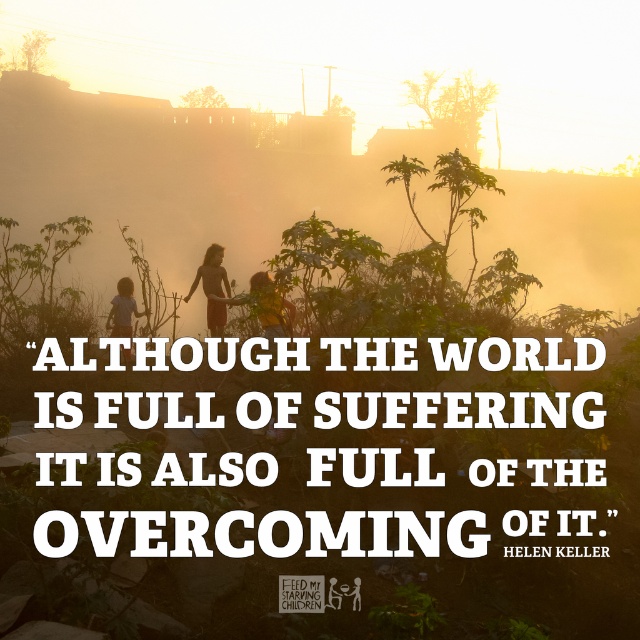
You are a photographer trying to capture the three children walking along the path in the foreground. You notice the yellow shirt at center and the light brown wooden stick at lower left. Which object should you focus on first if you want to ensure both are in sharp focus, considering their heights?

The yellow shirt at center is shorter than the light brown wooden stick at lower left, so you should focus on the light brown wooden stick at lower left first since it is taller and will require a different focal plane.

You are a photographer trying to capture the matte brown dress at center in the scene. The camera is positioned at the origin point. Can you determine if the dress is within the camera frame based on its coordinates?

The matte brown dress at center is located at point (212,289), which is within the camera frame since it falls within the standard coordinate system ranging from 0 to 1 in both axes. Therefore, the dress is visible in the frame.